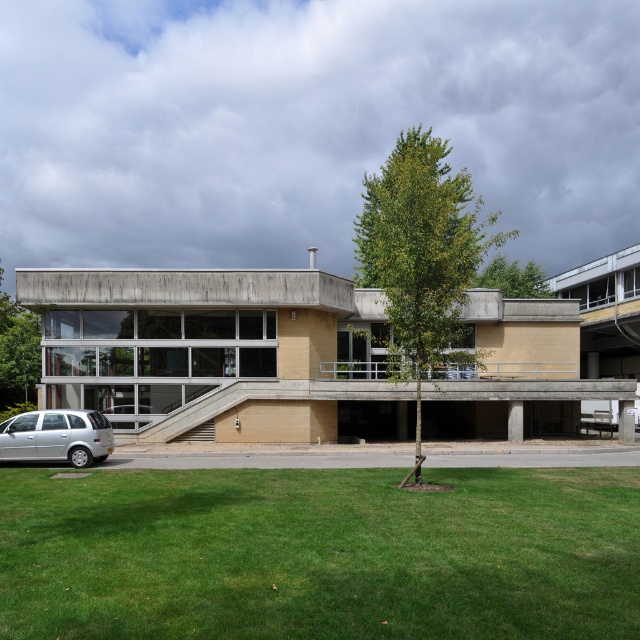
Can you confirm if green grass at lower center is smaller than green leafy tree at left?

Yes, green grass at lower center is smaller than green leafy tree at left.

The width and height of the screenshot is (640, 640). What are the coordinates of `green grass at lower center` in the screenshot? It's located at (320, 554).

Is point (0, 362) positioned in front of point (504, 296)?

Yes, it is.

Is green leafy tree at left behind green leafy tree at upper right?

No, it is not.

Between point (38, 355) and point (540, 269), which one is positioned in front?

Point (38, 355)

Image resolution: width=640 pixels, height=640 pixels. In order to click on green leafy tree at left in this screenshot , I will do `click(17, 352)`.

Which is behind, point (280, 522) or point (442, 170)?

The point (442, 170) is behind.

Which is more to the left, green grass at lower center or green leafy tree at center?

green grass at lower center

Is point (516, 544) closer to camera compared to point (396, 205)?

That is True.

Find the location of a particular element. The width and height of the screenshot is (640, 640). green grass at lower center is located at coordinates (320, 554).